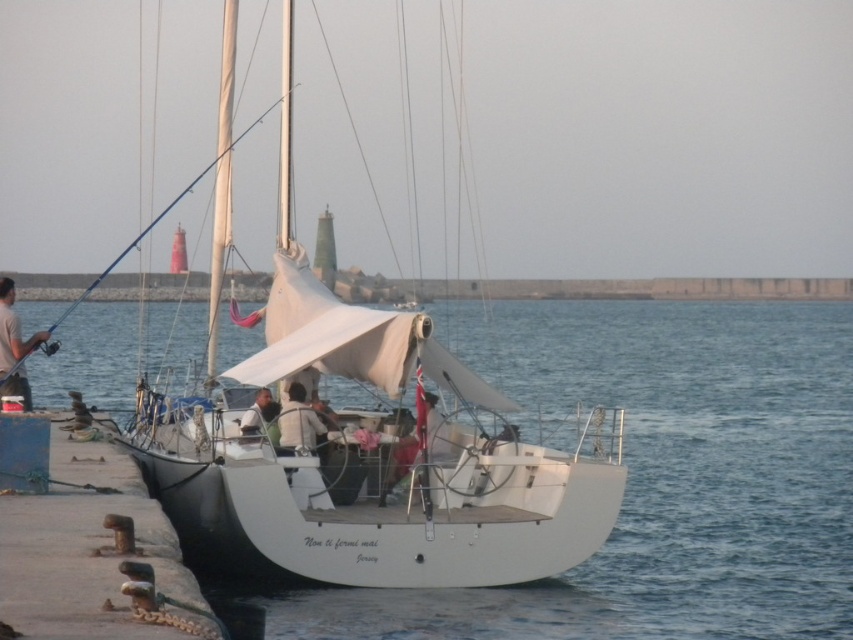
Question: Among these points, which one is farthest from the camera?

Choices:
 (A) (395, 408)
 (B) (583, 301)

Answer: (B)

Question: Among these points, which one is farthest from the camera?

Choices:
 (A) tap(6, 372)
 (B) tap(445, 339)
 (C) tap(592, 422)
 (D) tap(142, 547)

Answer: (B)

Question: Observing the image, what is the correct spatial positioning of white matte water at center in reference to rusty metal bollards at lower left?

Choices:
 (A) left
 (B) right

Answer: (A)

Question: Which object appears farthest from the camera in this image?

Choices:
 (A) white matte sailboat at center
 (B) white matte mast at center
 (C) rusty metal bollards at lower left
 (D) white matte water at center

Answer: (B)

Question: Does rusty metal bollards at lower left appear on the right side of light brown leather jacket at left?

Choices:
 (A) yes
 (B) no

Answer: (A)

Question: Can you confirm if white matte sailboat at center is wider than light brown leather jacket at left?

Choices:
 (A) yes
 (B) no

Answer: (A)